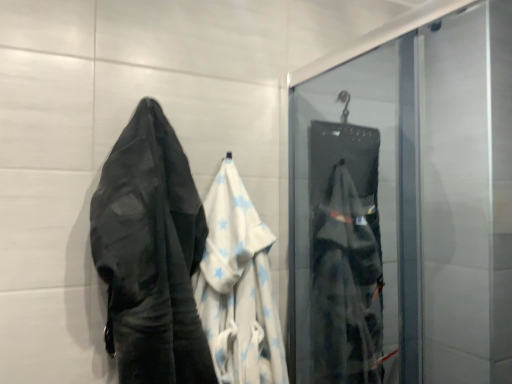
Question: Considering the relative sizes of white cotton towel at left and white cotton towel at center in the image provided, is white cotton towel at left shorter than white cotton towel at center?

Choices:
 (A) no
 (B) yes

Answer: (A)

Question: From a real-world perspective, does white cotton towel at left stand above white cotton towel at center?

Choices:
 (A) yes
 (B) no

Answer: (A)

Question: Can you confirm if white cotton towel at left is wider than white cotton towel at center?

Choices:
 (A) yes
 (B) no

Answer: (A)

Question: Considering the relative positions of white cotton towel at left and white cotton towel at center in the image provided, is white cotton towel at left to the left of white cotton towel at center from the viewer's perspective?

Choices:
 (A) no
 (B) yes

Answer: (B)

Question: Considering the relative sizes of white cotton towel at left and white cotton towel at center in the image provided, is white cotton towel at left taller than white cotton towel at center?

Choices:
 (A) no
 (B) yes

Answer: (B)

Question: From the image's perspective, would you say white cotton towel at left is positioned over white cotton towel at center?

Choices:
 (A) no
 (B) yes

Answer: (B)

Question: Is white cotton towel at left to the right of matte black bag at right from the viewer's perspective?

Choices:
 (A) no
 (B) yes

Answer: (A)

Question: From the image's perspective, does white cotton towel at left appear lower than matte black bag at right?

Choices:
 (A) no
 (B) yes

Answer: (A)

Question: Can you confirm if white cotton towel at left is positioned to the left of matte black bag at right?

Choices:
 (A) yes
 (B) no

Answer: (A)

Question: Is white cotton towel at left wider than matte black bag at right?

Choices:
 (A) yes
 (B) no

Answer: (A)

Question: Can you confirm if white cotton towel at left is taller than matte black bag at right?

Choices:
 (A) no
 (B) yes

Answer: (A)

Question: Does white cotton towel at left have a smaller size compared to matte black bag at right?

Choices:
 (A) no
 (B) yes

Answer: (B)

Question: Is white cotton towel at center inside matte black bag at right?

Choices:
 (A) no
 (B) yes

Answer: (A)